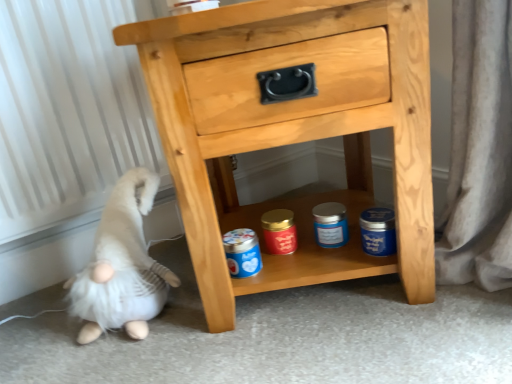
At what (x,y) coordinates should I click in order to perform the action: click on vacant area located to the right-hand side of white plush gnome at lower left. Please return your answer as a coordinate pair (x, y). This screenshot has width=512, height=384. Looking at the image, I should click on (225, 324).